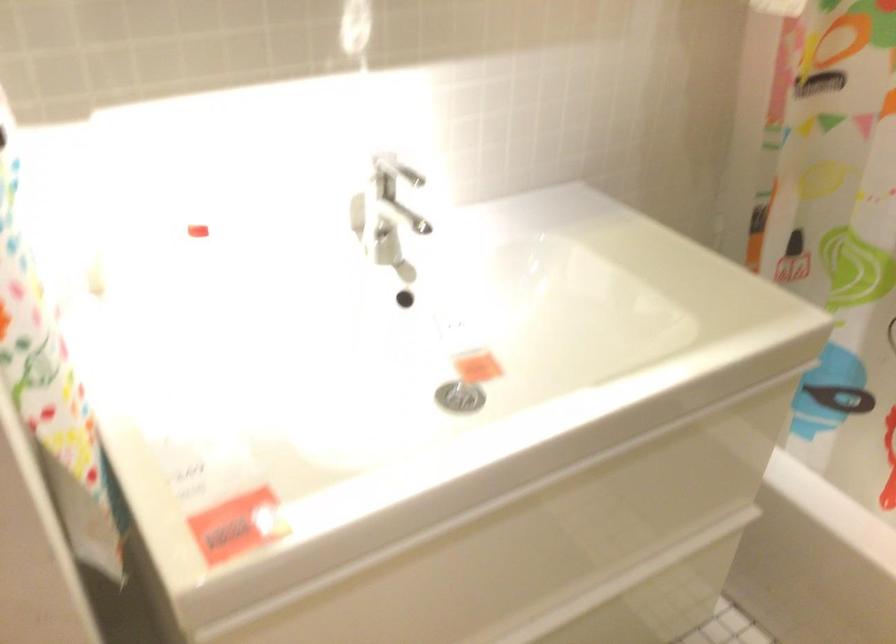
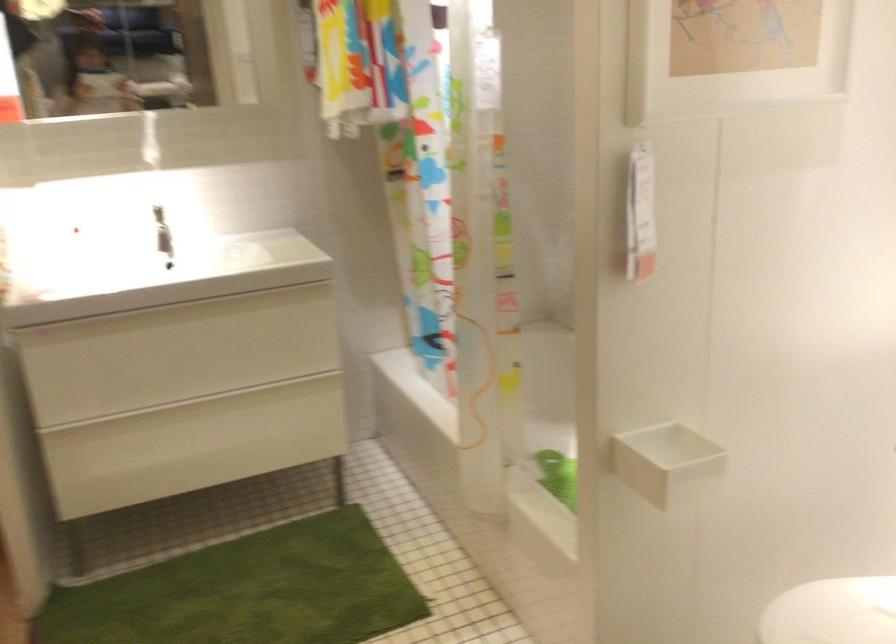
Which direction would the cameraman need to move to produce the second image?

The cameraman walked toward right, backward.